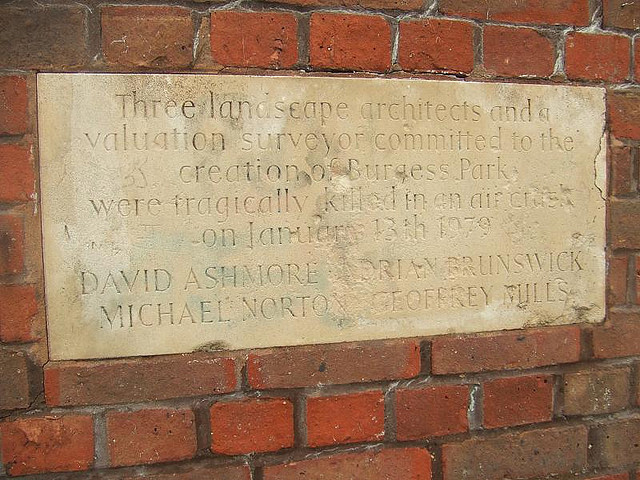
This screenshot has width=640, height=480. I want to click on grout line between bricks, so click(x=393, y=44).